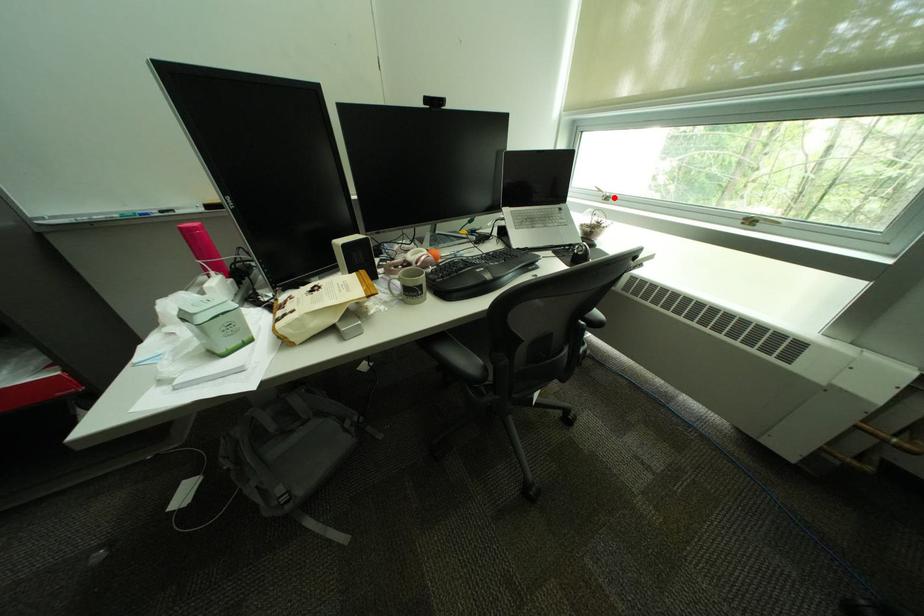
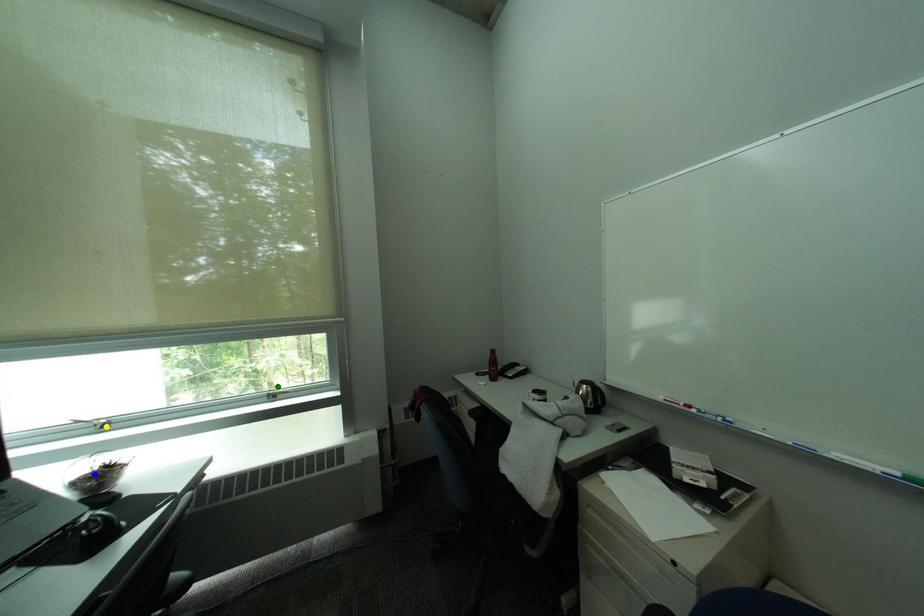
Question: I am providing you with two images of the same scene from different viewpoints. A red point is marked on the first image. You are given multiple points on the second image. Which mark in image 2 goes with the point in image 1?

Choices:
 (A) yellow point
 (B) green point
 (C) blue point

Answer: (A)